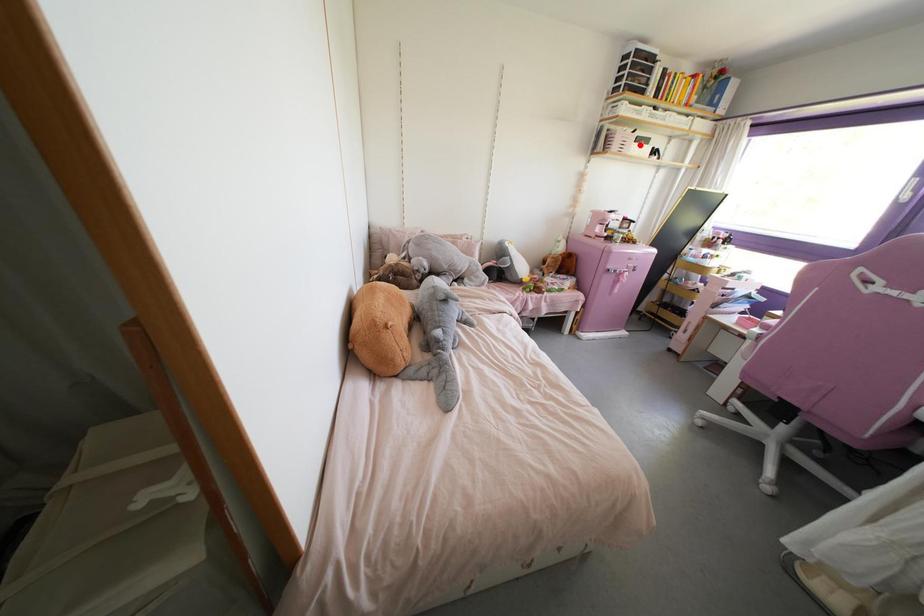
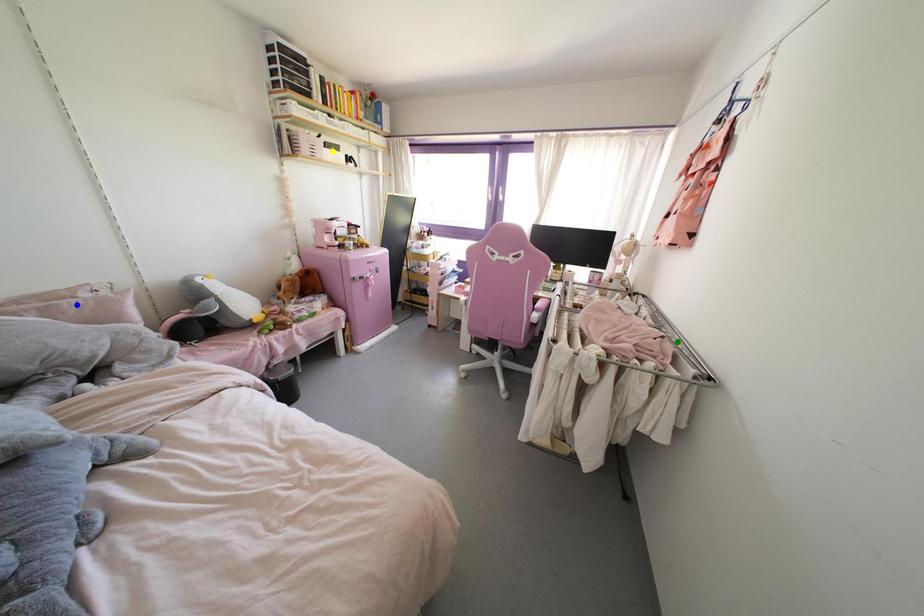
Question: I am providing you with two images of the same scene from different viewpoints. A red point is marked on the first image. You are given multiple points on the second image. Which point in image 2 represents the same 3d spot as the red point in image 1?

Choices:
 (A) blue point
 (B) yellow point
 (C) green point

Answer: (B)